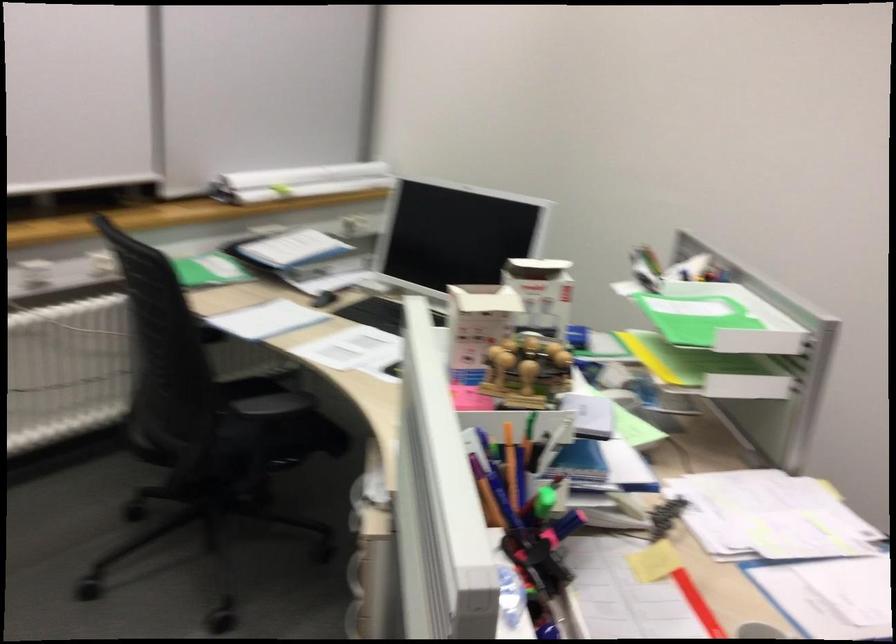
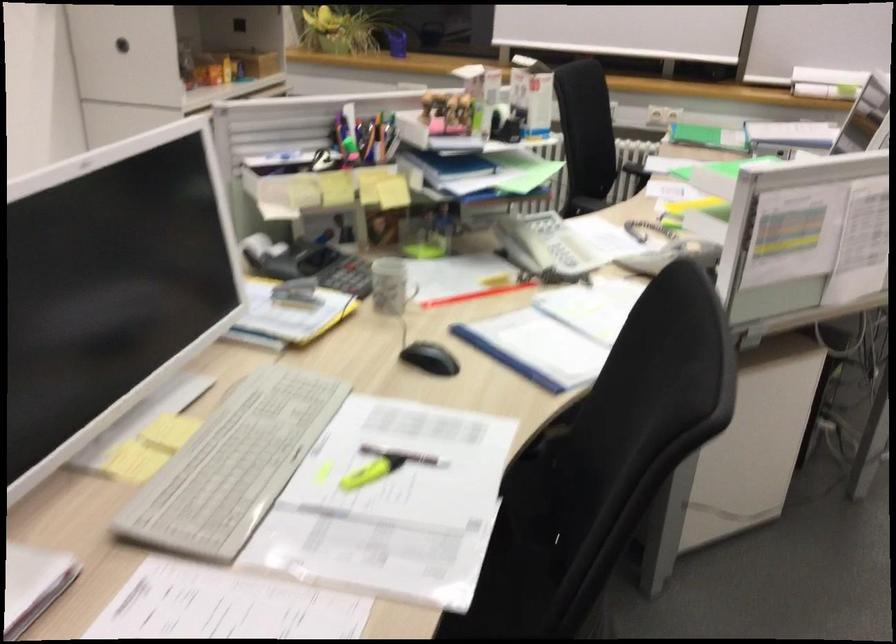
The point at [599,498] is marked in the first image. Where is the corresponding point in the second image?

(522, 243)